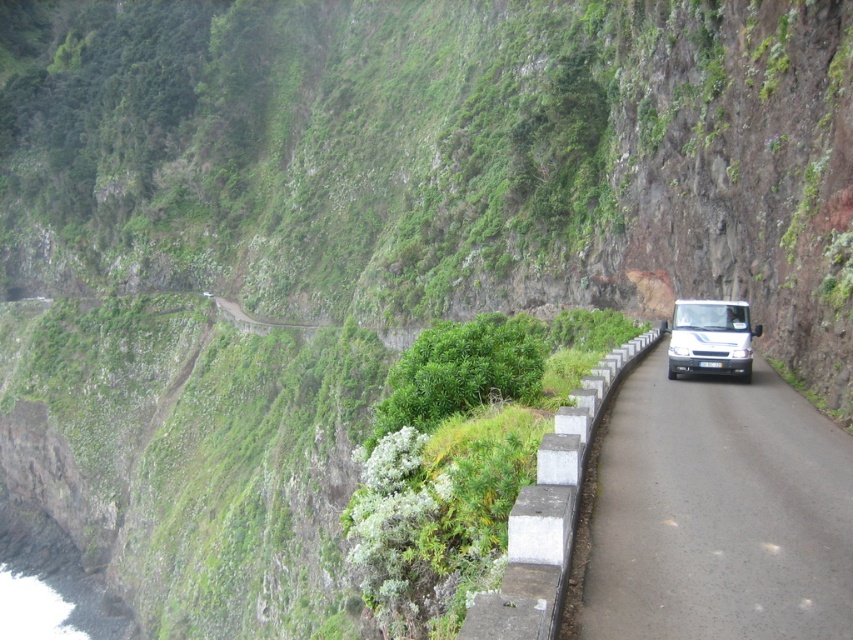
In the scene shown: You are driving a white matte van at center and want to park it on the black asphalt road at right. Can you safely park the van on the road without crossing the concrete barriers on the right side?

The black asphalt road at right is to the left of the white matte van at center, so parking the van there would require moving it to the left. However, the road is bordered by concrete barriers on its right side, which are meant to prevent vehicles from going over the cliff edge. Since the van is currently at the center, moving it to the road on the right might place it near the barriers. The question mentions the road is narrow and winding, so there might not be enough space to park safely without crossing

You are driving a delivery van and need to pass another vehicle on this narrow road. The road is bordered by concrete barriers on the right. Can you safely pass the other vehicle using the space provided by the black asphalt road at right and the white matte van at center?

The black asphalt road at right is larger in size than the white matte van at center, so there should be enough space to safely pass the other vehicle using the road area next to the barriers.